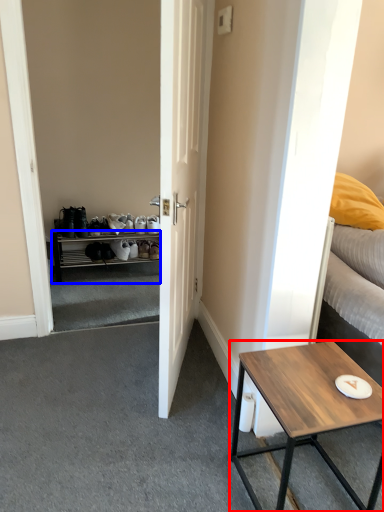
Question: Which object appears farthest to the camera in this image, coffee table (highlighted by a red box) or cabinetry (highlighted by a blue box)?

Choices:
 (A) coffee table
 (B) cabinetry

Answer: (B)